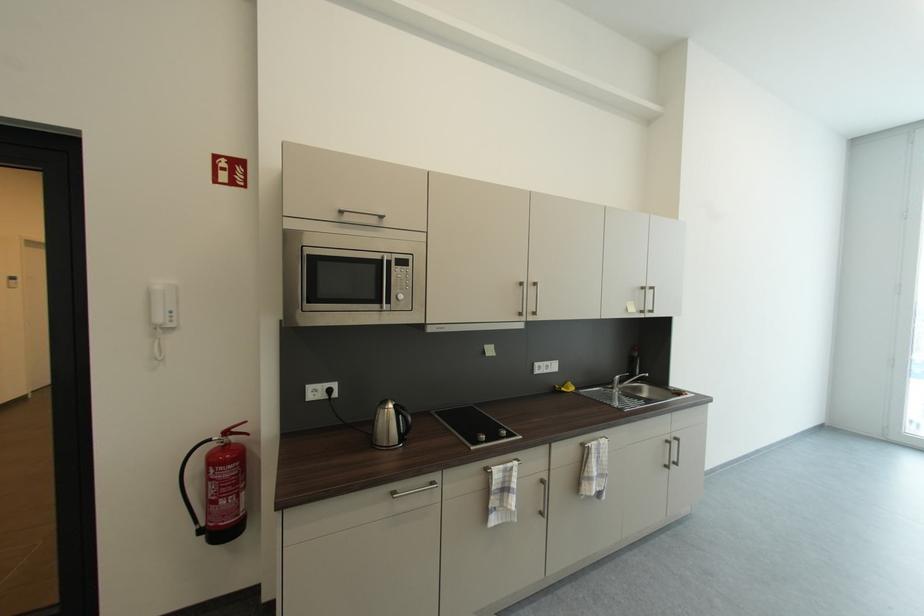
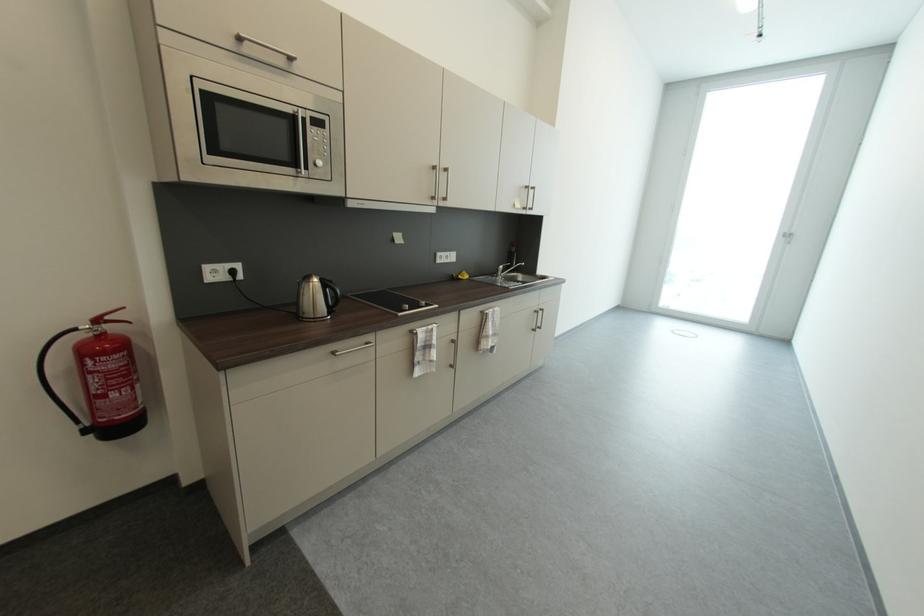
Find the pixel in the second image that matches [674,443] in the first image.

(541, 313)